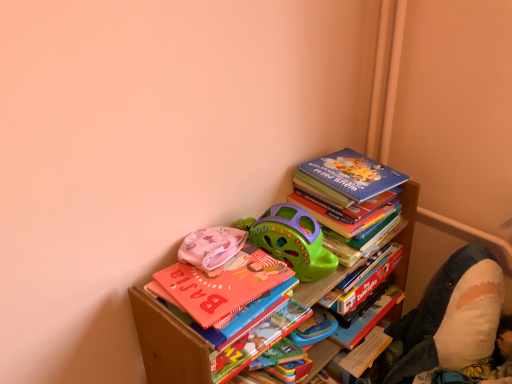
Find the location of a particular element. This screenshot has height=384, width=512. wooden bookcase at upper right is located at coordinates (167, 344).

You are a GUI agent. You are given a task and a screenshot of the screen. Output one action in this format:
    pyautogui.click(x=<x>, y=<y>)
    Task: Click on the blue matte book at upper right
    
    Given the screenshot: What is the action you would take?
    pyautogui.click(x=345, y=190)

What is the approximate width of soft plush shark at right, which is the third toy from left to right?

soft plush shark at right, which is the third toy from left to right, is 26.54 centimeters in width.

Locate an element on the screen. Image resolution: width=512 pixels, height=384 pixels. wooden bookcase at upper right is located at coordinates (167, 344).

Considering the relative positions of green plastic toy car at upper center, which is the second toy from right to left, and blue matte book at upper right in the image provided, is green plastic toy car at upper center, which is the second toy from right to left, to the left or to the right of blue matte book at upper right?

From the image, it's evident that green plastic toy car at upper center, which is the second toy from right to left, is to the left of blue matte book at upper right.

Between green plastic toy car at upper center, positioned as the 2th toy in left-to-right order, and blue matte book at upper right, which one has less height?

blue matte book at upper right is shorter.

Is green plastic toy car at upper center, which is the second toy from right to left, oriented towards blue matte book at upper right?

No, green plastic toy car at upper center, which is the second toy from right to left, is not turned towards blue matte book at upper right.

From a real-world perspective, is green plastic toy car at upper center, positioned as the 2th toy in left-to-right order, beneath blue matte book at upper right?

Indeed, from a real-world perspective, green plastic toy car at upper center, positioned as the 2th toy in left-to-right order, is positioned beneath blue matte book at upper right.

In terms of width, does pink fabric at upper left, which is the third toy in right-to-left order, look wider or thinner when compared to blue matte book at upper right?

pink fabric at upper left, which is the third toy in right-to-left order, is thinner than blue matte book at upper right.

Measure the distance from pink fabric at upper left, which is the third toy in right-to-left order, to blue matte book at upper right.

14.30 inches.

Is the surface of pink fabric at upper left, which is the third toy in right-to-left order, in direct contact with blue matte book at upper right?

pink fabric at upper left, which is the third toy in right-to-left order, is not next to blue matte book at upper right, and they're not touching.

Is pink fabric at upper left, which ranks as the 1th toy in left-to-right order, situated inside blue matte book at upper right or outside?

pink fabric at upper left, which ranks as the 1th toy in left-to-right order, lies outside blue matte book at upper right.

Would you say blue matte book at upper right is inside or outside hardcover book at upper right, positioned as the 1th paperback book in top-to-bottom order?

blue matte book at upper right is located beyond the bounds of hardcover book at upper right, positioned as the 1th paperback book in top-to-bottom order.

What's the angular difference between blue matte book at upper right and hardcover book at upper right, arranged as the first paperback book when viewed from the right,'s facing directions?

The angular difference between blue matte book at upper right and hardcover book at upper right, arranged as the first paperback book when viewed from the right, is 4.05 degrees.

Is blue matte book at upper right far away from hardcover book at upper right, positioned as the 1th paperback book in top-to-bottom order?

blue matte book at upper right is actually quite close to hardcover book at upper right, positioned as the 1th paperback book in top-to-bottom order.

Is hardcover book at upper right, arranged as the first paperback book when viewed from the right, at the back of blue matte book at upper right?

No, blue matte book at upper right is not facing away from hardcover book at upper right, arranged as the first paperback book when viewed from the right.

From the picture: Is pink fabric at upper left, which is the third toy in right-to-left order, completely or partially outside of multicolored paper at center, which is the 1th paperback book in left-to-right order?

Indeed, pink fabric at upper left, which is the third toy in right-to-left order, is completely outside multicolored paper at center, which is the 1th paperback book in left-to-right order.

Is pink fabric at upper left, which is the third toy in right-to-left order, positioned far away from multicolored paper at center, which is the 1th paperback book in left-to-right order?

pink fabric at upper left, which is the third toy in right-to-left order, is near multicolored paper at center, which is the 1th paperback book in left-to-right order, not far away.

From the picture: From the image's perspective, who appears lower, pink fabric at upper left, which ranks as the 1th toy in left-to-right order, or multicolored paper at center, acting as the second paperback book starting from the top?

From the image's view, multicolored paper at center, acting as the second paperback book starting from the top, is below.

Considering the sizes of objects pink fabric at upper left, which is the third toy in right-to-left order, and multicolored paper at center, acting as the second paperback book starting from the top, in the image provided, who is taller, pink fabric at upper left, which is the third toy in right-to-left order, or multicolored paper at center, acting as the second paperback book starting from the top,?

With more height is multicolored paper at center, acting as the second paperback book starting from the top.

From the image's perspective, is wooden bookcase at upper right located above or below blue matte book at upper right?

wooden bookcase at upper right is below blue matte book at upper right.

Which object is wider, wooden bookcase at upper right or blue matte book at upper right?

Wider between the two is wooden bookcase at upper right.

Can you confirm if wooden bookcase at upper right is bigger than blue matte book at upper right?

Yes.

Who is bigger, wooden bookcase at upper right or multicolored paper at center, marked as the 2th paperback book in a right-to-left arrangement?

Bigger between the two is wooden bookcase at upper right.

Is wooden bookcase at upper right positioned with its back to multicolored paper at center, which is the 1th paperback book in left-to-right order?

Absolutely, wooden bookcase at upper right is directed away from multicolored paper at center, which is the 1th paperback book in left-to-right order.

Does point (206, 370) appear closer or farther from the camera than point (305, 316)?

Point (206, 370) is closer to the camera than point (305, 316).

Does wooden bookcase at upper right come behind multicolored paper at center, marked as the 2th paperback book in a right-to-left arrangement?

No, it is in front of multicolored paper at center, marked as the 2th paperback book in a right-to-left arrangement.

From a real-world perspective, relative to pink fabric at upper left, which ranks as the 1th toy in left-to-right order, is wooden bookcase at upper right vertically above or below?

From a real-world perspective, wooden bookcase at upper right is physically below pink fabric at upper left, which ranks as the 1th toy in left-to-right order.

Is wooden bookcase at upper right taller or shorter than pink fabric at upper left, which is the third toy in right-to-left order?

Considering their sizes, wooden bookcase at upper right has more height than pink fabric at upper left, which is the third toy in right-to-left order.

Which is behind, wooden bookcase at upper right or pink fabric at upper left, which is the third toy in right-to-left order?

Positioned behind is pink fabric at upper left, which is the third toy in right-to-left order.

Image resolution: width=512 pixels, height=384 pixels. In the image, there is a pink fabric at upper left, which is the third toy in right-to-left order. Identify the location of bookcase below it (from a real-world perspective). (167, 344).

The width and height of the screenshot is (512, 384). I want to click on the 1st toy to the left when counting from the blue matte book at upper right, so click(x=292, y=241).

At what (x,y) coordinates should I click in order to perform the action: click on book lying behind the pink fabric at upper left, which is the third toy in right-to-left order. Please return your answer as a coordinate pair (x, y). Image resolution: width=512 pixels, height=384 pixels. Looking at the image, I should click on (345, 190).

When comparing their distances from pink fabric at upper left, which is the third toy in right-to-left order, does wooden bookcase at upper right or hardcover book at upper right, the 2th paperback book from the left, seem further?

Based on the image, hardcover book at upper right, the 2th paperback book from the left, appears to be further to pink fabric at upper left, which is the third toy in right-to-left order.

From the image, which object appears to be farther from pink fabric at upper left, which is the third toy in right-to-left order, blue matte book at upper right or soft plush shark at right, the 1th toy viewed from the right?

Based on the image, soft plush shark at right, the 1th toy viewed from the right, appears to be further to pink fabric at upper left, which is the third toy in right-to-left order.

From the image, which object appears to be farther from hardcover book at upper right, arranged as the first paperback book when viewed from the right, blue matte book at upper right or soft plush shark at right, the 1th toy viewed from the right?

soft plush shark at right, the 1th toy viewed from the right, lies further to hardcover book at upper right, arranged as the first paperback book when viewed from the right, than the other object.

Based on their spatial positions, is hardcover book at upper right, the 2th paperback book from the left, or pink fabric at upper left, which ranks as the 1th toy in left-to-right order, closer to wooden bookcase at upper right?

pink fabric at upper left, which ranks as the 1th toy in left-to-right order, is positioned closer to the anchor wooden bookcase at upper right.

Which object lies further to the anchor point green plastic toy car at upper center, which is the second toy from right to left, blue matte book at upper right or multicolored paper at center, acting as the second paperback book starting from the top?

Among the two, multicolored paper at center, acting as the second paperback book starting from the top, is located further to green plastic toy car at upper center, which is the second toy from right to left.

Based on the photo, from the image, which object appears to be nearer to multicolored paper at center, which is the 1th paperback book in left-to-right order, wooden bookcase at upper right or soft plush shark at right, the 1th toy viewed from the right?

wooden bookcase at upper right lies closer to multicolored paper at center, which is the 1th paperback book in left-to-right order, than the other object.

Based on their spatial positions, is green plastic toy car at upper center, which is the second toy from right to left, or soft plush shark at right, the 1th toy viewed from the right, closer to hardcover book at upper right, positioned as the 1th paperback book in top-to-bottom order?

green plastic toy car at upper center, which is the second toy from right to left, lies closer to hardcover book at upper right, positioned as the 1th paperback book in top-to-bottom order, than the other object.

Considering their positions, is green plastic toy car at upper center, positioned as the 2th toy in left-to-right order, positioned closer to pink fabric at upper left, which is the third toy in right-to-left order, than multicolored paper at center, acting as the second paperback book starting from the top?

green plastic toy car at upper center, positioned as the 2th toy in left-to-right order, is positioned closer to the anchor pink fabric at upper left, which is the third toy in right-to-left order.

Locate an element on the screen. paperback book between green plastic toy car at upper center, positioned as the 2th toy in left-to-right order, and soft plush shark at right, which is the third toy from left to right, in the horizontal direction is located at coordinates (364, 283).

Locate an element on the screen. book between multicolored paper at center, acting as the second paperback book starting from the top, and soft plush shark at right, which is the third toy from left to right, from left to right is located at coordinates (345, 190).

Identify the location of paperback book that lies between blue matte book at upper right and multicolored paper at center, the first paperback book in the bottom-to-top sequence, from top to bottom. (364, 283).

The height and width of the screenshot is (384, 512). In order to click on toy between pink fabric at upper left, which ranks as the 1th toy in left-to-right order, and soft plush shark at right, the 1th toy viewed from the right, from left to right in this screenshot , I will do `click(292, 241)`.